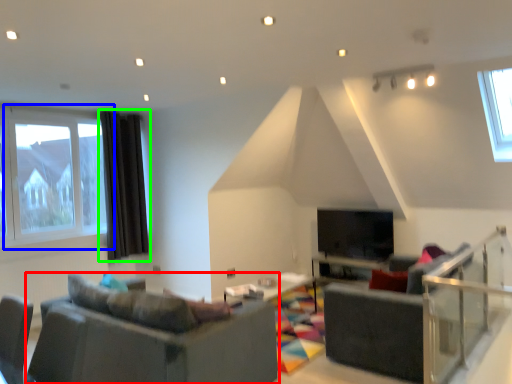
Question: Which is farther away from studio couch (highlighted by a red box)? window (highlighted by a blue box) or curtain (highlighted by a green box)?

Choices:
 (A) window
 (B) curtain

Answer: (B)